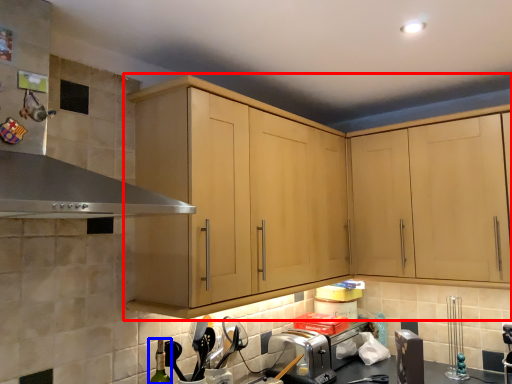
Question: Which point is further to the camera, cabinetry (highlighted by a red box) or bottle (highlighted by a blue box)?

Choices:
 (A) cabinetry
 (B) bottle

Answer: (B)